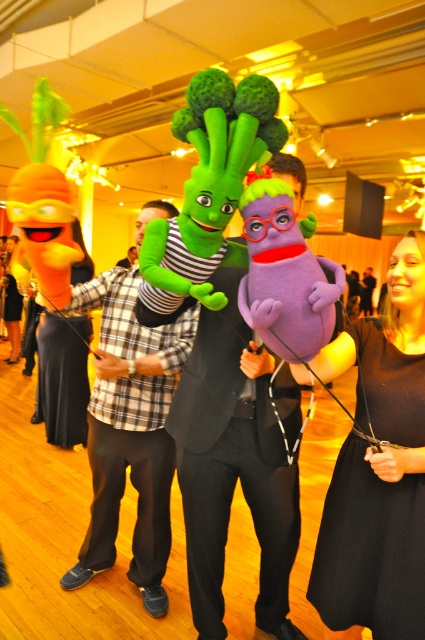
Who is shorter, green plush toy at center or matte black suit at center?

green plush toy at center is shorter.

Can you confirm if green plush toy at center is bigger than matte black suit at center?

No.

This screenshot has width=425, height=640. I want to click on green plush toy at center, so click(209, 188).

At what (x,y) coordinates should I click in order to perform the action: click on green plush toy at center. Please return your answer as a coordinate pair (x, y). Looking at the image, I should click on (209, 188).

Is point (99, 369) closer to viewer compared to point (5, 323)?

Yes, it is in front of point (5, 323).

Is plush green costume at center to the right of black dress at center from the viewer's perspective?

Indeed, plush green costume at center is positioned on the right side of black dress at center.

Between point (158, 602) and point (16, 326), which one is positioned in front?

Point (158, 602)

Identify the location of plush green costume at center. (130, 432).

In the scene shown: Which is more to the right, black satin dress at lower right or green plush toy at center?

black satin dress at lower right is more to the right.

Who is more distant from viewer, (357, 452) or (186, 291)?

The point (357, 452) is more distant.

You are a GUI agent. You are given a task and a screenshot of the screen. Output one action in this format:
    pyautogui.click(x=<x>, y=<y>)
    Task: Click on the black satin dress at lower right
    The image size is (425, 640).
    Given the screenshot: What is the action you would take?
    pyautogui.click(x=370, y=548)